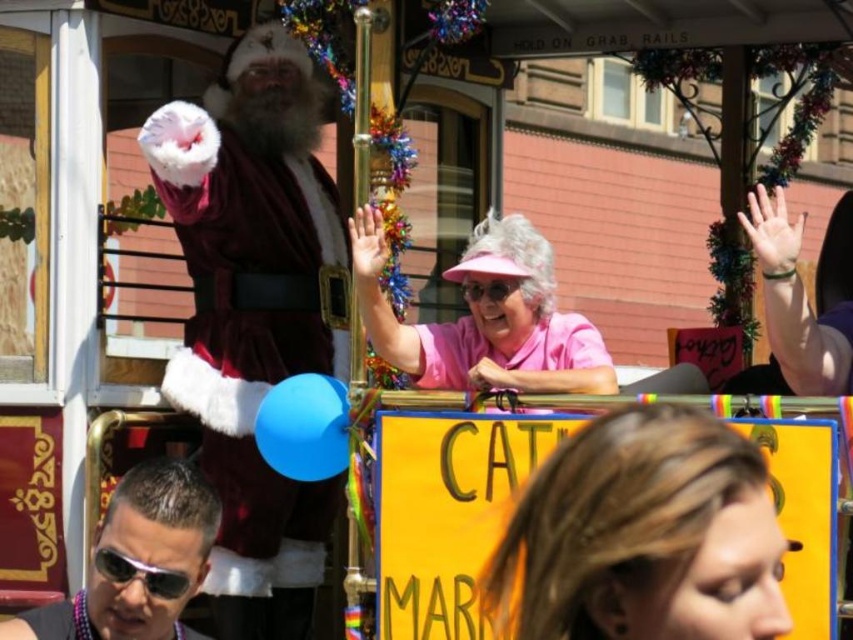
Question: Among these points, which one is nearest to the camera?

Choices:
 (A) pos(96,566)
 (B) pos(518,346)
 (C) pos(711,634)
 (D) pos(485,291)

Answer: (C)

Question: Can you confirm if sunglasses at center is thinner than pink rubber goggles at center?

Choices:
 (A) no
 (B) yes

Answer: (A)

Question: Which object is positioned farthest from the pink rubber goggles at center?

Choices:
 (A) shiny black sunglasses at center
 (B) sunglasses at center

Answer: (B)

Question: Observing the image, what is the correct spatial positioning of pink fabric hat at upper center in reference to sunglasses at center?

Choices:
 (A) below
 (B) above

Answer: (B)

Question: Is velvet maroon santa at left above sunglasses at center?

Choices:
 (A) yes
 (B) no

Answer: (A)

Question: Which of the following is the closest to the observer?

Choices:
 (A) (498, 285)
 (B) (204, 520)
 (C) (331, 500)

Answer: (B)